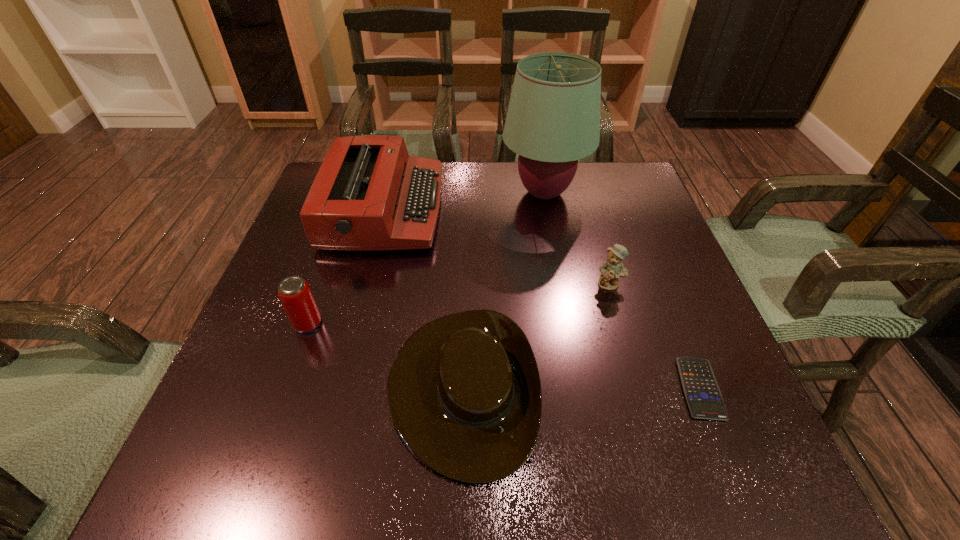
Find the location of a particular element. The height and width of the screenshot is (540, 960). the tallest object is located at coordinates (553, 120).

You are a GUI agent. You are given a task and a screenshot of the screen. Output one action in this format:
    pyautogui.click(x=<x>, y=<y>)
    Task: Click on the typewriter
    The height and width of the screenshot is (540, 960).
    Given the screenshot: What is the action you would take?
    pyautogui.click(x=369, y=194)

Locate an element on the screen. Image resolution: width=960 pixels, height=540 pixels. beer can is located at coordinates (294, 292).

Where is `teddy bear`? teddy bear is located at coordinates (613, 269).

Where is `the second shortest object`? The image size is (960, 540). the second shortest object is located at coordinates [464, 393].

Identify the location of the rightmost object. (701, 390).

The height and width of the screenshot is (540, 960). In order to click on calculator in this screenshot , I will do `click(701, 390)`.

The image size is (960, 540). Find the location of `free location located on the left of the tallest object`. free location located on the left of the tallest object is located at coordinates (429, 193).

Image resolution: width=960 pixels, height=540 pixels. I want to click on vacant region located on the typing side of the typewriter, so [519, 209].

Where is `vacant space located on the right of the beer can`? vacant space located on the right of the beer can is located at coordinates (414, 323).